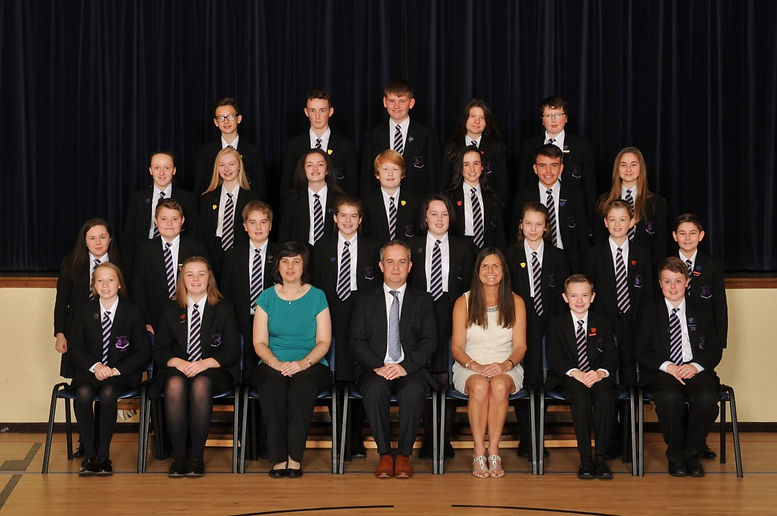
Where is `chairs`? chairs is located at coordinates (68, 391), (225, 397), (253, 390), (357, 392), (525, 399), (559, 398), (723, 396).